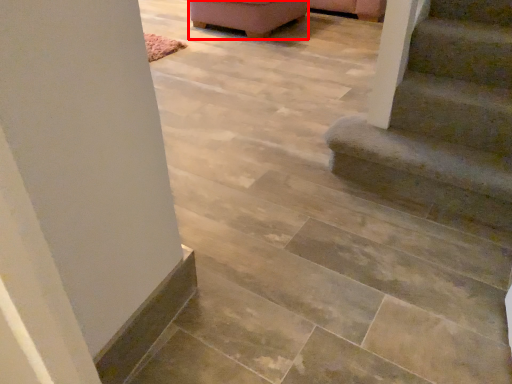
Question: From the image's perspective, considering the relative positions of furniture (annotated by the red box) and stairs in the image provided, where is furniture (annotated by the red box) located with respect to the staircase?

Choices:
 (A) below
 (B) above

Answer: (B)